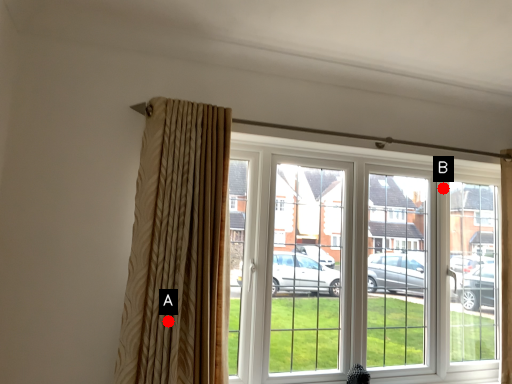
Question: Two points are circled on the image, labeled by A and B beside each circle. Which point is closer to the camera taking this photo?

Choices:
 (A) A is closer
 (B) B is closer

Answer: (A)